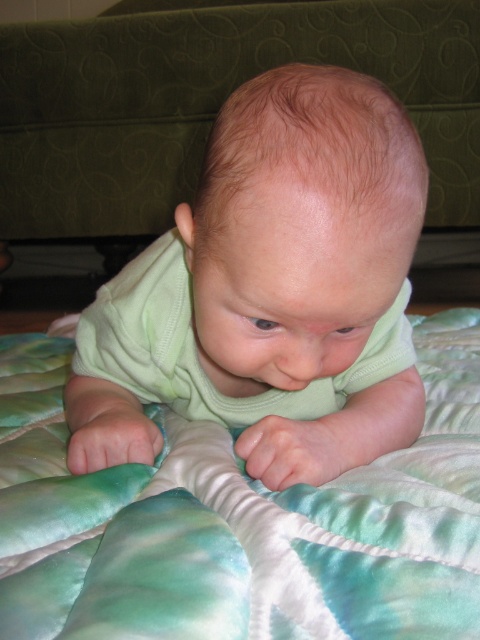
You are a photographer trying to capture the baby in the center of the image. The camera has a grid overlay with coordinates from 0 to 1 on both the x and y axes. According to the image, where should you position the camera to center the green smooth baby at center?

The green smooth baby at center is located at the 2D coordinates point of [271,291], so you should position the camera to center at those coordinates to capture the baby in the center of the image.

You are a photographer taking a picture of the green smooth baby at center and the green satin quilt at center. Which object will appear larger in the photo?

The green smooth baby at center will appear larger in the photo because it is closer to the viewer than the green satin quilt at center.

You are a photographer taking a picture of the baby. You want to focus on the baby at the point specified. Where should you aim your camera to capture the baby at point (x=271, y=291)?

The green smooth baby at center is located at point (x=271, y=291), so you should aim your camera at that point to capture the baby.